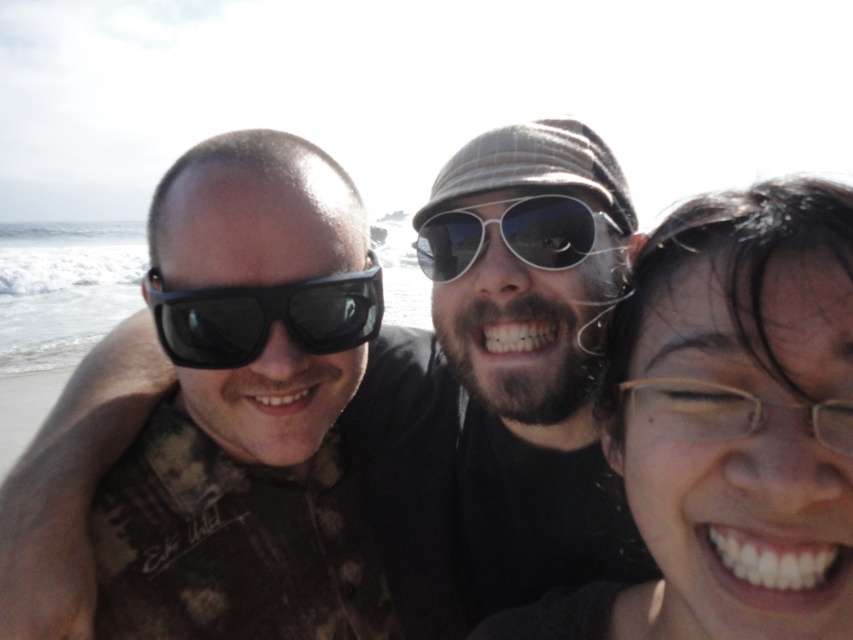
Who is more distant from viewer, (x=758, y=536) or (x=329, y=289)?

The point (x=329, y=289) is behind.

Between point (640, 292) and point (381, 291), which one is positioned in front?

Positioned in front is point (640, 292).

Locate an element on the screen. This screenshot has width=853, height=640. clear plastic glasses at center is located at coordinates (729, 426).

Can you confirm if clear plastic glasses at center is wider than metal aviator sunglasses at center?

No, clear plastic glasses at center is not wider than metal aviator sunglasses at center.

Is the position of clear plastic glasses at center more distant than that of metal aviator sunglasses at center?

That is False.

Between point (844, 307) and point (476, 257), which one is positioned behind?

The point (476, 257) is behind.

I want to click on clear plastic glasses at center, so click(729, 426).

Looking at this image, does matte black sunglasses at left have a smaller size compared to metal aviator sunglasses at center?

Incorrect, matte black sunglasses at left is not smaller in size than metal aviator sunglasses at center.

Can you confirm if matte black sunglasses at left is positioned to the left of metal aviator sunglasses at center?

Indeed, matte black sunglasses at left is positioned on the left side of metal aviator sunglasses at center.

This screenshot has width=853, height=640. Find the location of `matte black sunglasses at left`. matte black sunglasses at left is located at coordinates [264, 316].